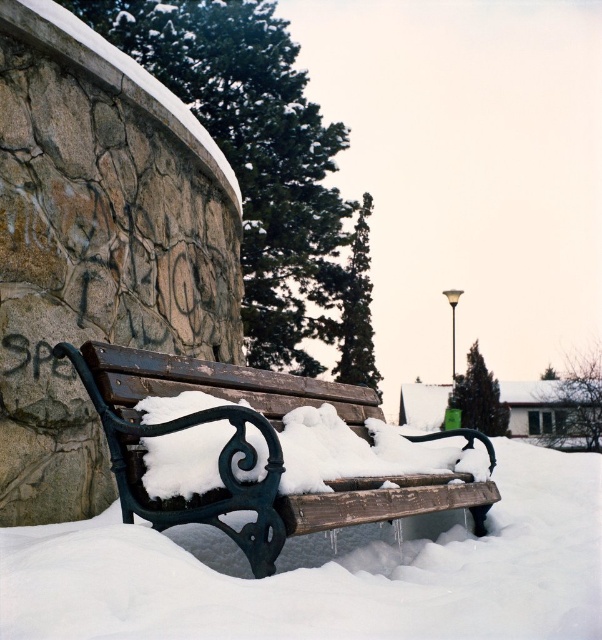
You are standing in the winter scene and want to sit on the wooden bench at center. Is the white fluffy snow at center located to the right or left of the bench?

The white fluffy snow at center is to the right of the wooden bench at center according to the description.

You are a snowplow operator trying to clear snow from the wooden bench at center. You notice the white fluffy snow at center. Can you tell me which object is taller so you know where to direct the plow?

The wooden bench at center is taller than the white fluffy snow at center, so you should direct the plow towards the snow since it is shorter.